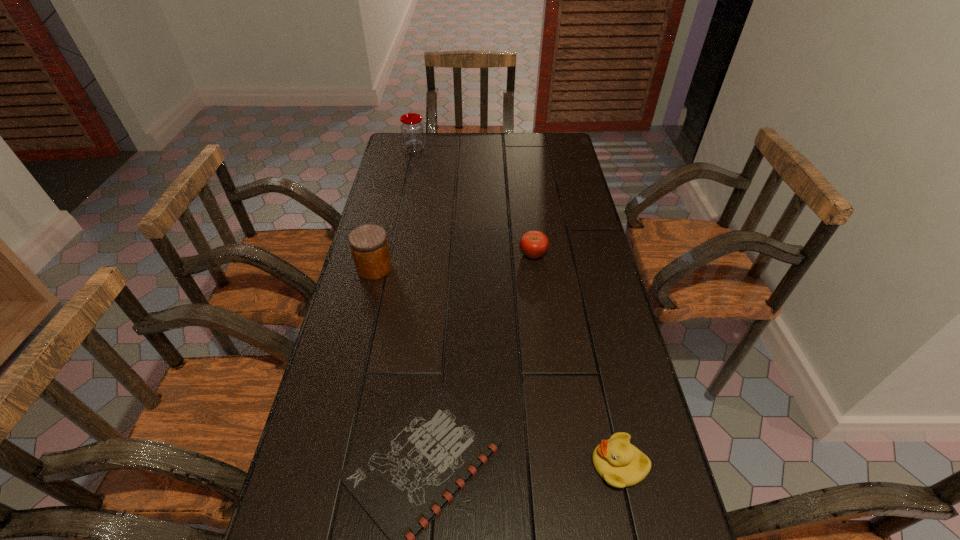
Find the location of a particular element. The image size is (960, 540). object that is at the far edge is located at coordinates (412, 128).

Identify the location of object that is at the right edge. Image resolution: width=960 pixels, height=540 pixels. (621, 464).

This screenshot has height=540, width=960. I want to click on object present at the far left corner, so click(412, 128).

Locate an element on the screen. This screenshot has width=960, height=540. blank space at the far edge is located at coordinates (442, 142).

Where is `vacant region at the left edge of the desktop`? This screenshot has height=540, width=960. vacant region at the left edge of the desktop is located at coordinates (421, 163).

Where is `free point at the right edge`? The width and height of the screenshot is (960, 540). free point at the right edge is located at coordinates (574, 244).

Image resolution: width=960 pixels, height=540 pixels. Find the location of `vacant space at the far right corner of the desktop`. vacant space at the far right corner of the desktop is located at coordinates (541, 143).

Find the location of a particular element. The image size is (960, 540). free space between the farthest object and the nearer jar is located at coordinates (395, 208).

Find the location of `free area in between the fourth object from left to right and the duckling`. free area in between the fourth object from left to right and the duckling is located at coordinates (576, 359).

Image resolution: width=960 pixels, height=540 pixels. In order to click on vacant point located between the farthest object and the fourth object from left to right in this screenshot , I will do `click(474, 201)`.